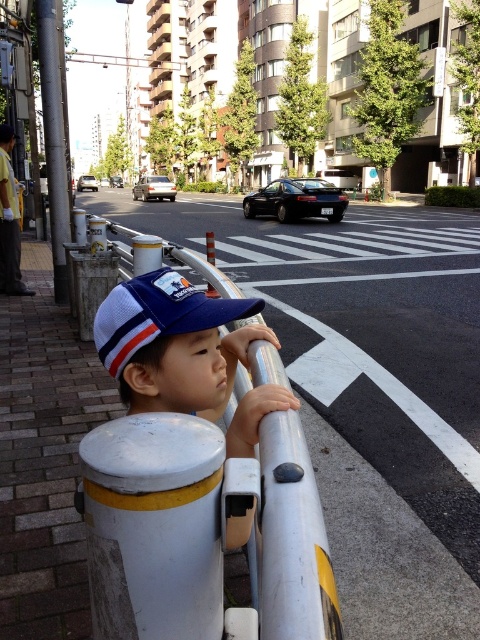
Which is below, matte blue cap at center or silver metallic pole at left?

Positioned lower is matte blue cap at center.

Is matte blue cap at center shorter than silver metallic pole at left?

Correct, matte blue cap at center is not as tall as silver metallic pole at left.

The height and width of the screenshot is (640, 480). What do you see at coordinates (157, 314) in the screenshot?
I see `matte blue cap at center` at bounding box center [157, 314].

The width and height of the screenshot is (480, 640). In order to click on matte blue cap at center in this screenshot , I will do 157,314.

Does silver metallic pole at left appear on the left side of yellow reflective vest at left?

No, silver metallic pole at left is not to the left of yellow reflective vest at left.

Does silver metallic pole at left have a larger size compared to yellow reflective vest at left?

Yes.

Locate an element on the screen. This screenshot has height=640, width=480. silver metallic pole at left is located at coordinates (55, 132).

Which is more to the right, matte blue cap at center or yellow reflective vest at left?

matte blue cap at center

Does matte blue cap at center have a smaller size compared to yellow reflective vest at left?

Correct, matte blue cap at center occupies less space than yellow reflective vest at left.

Does point (100, 307) lie in front of point (20, 282)?

Yes.

The height and width of the screenshot is (640, 480). I want to click on matte blue cap at center, so click(157, 314).